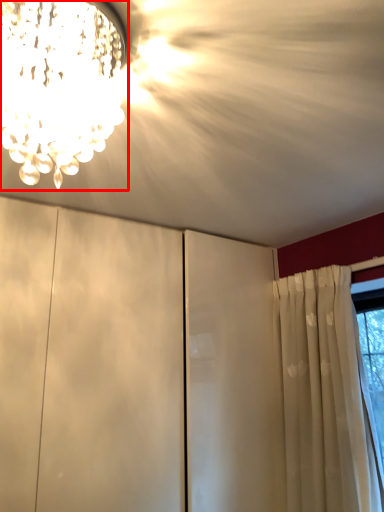
Question: From the image's perspective, considering the relative positions of lamp (annotated by the red box) and cloud in the image provided, where is lamp (annotated by the red box) located with respect to the staircase?

Choices:
 (A) above
 (B) below

Answer: (A)